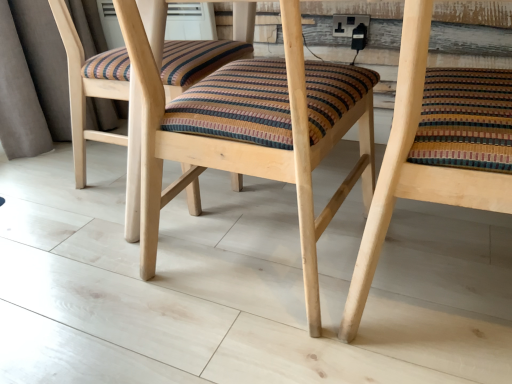
Question: Is wooden chair at center, the 1th chair viewed from the left, oriented away from wooden chair at center, the first chair in the right-to-left sequence?

Choices:
 (A) no
 (B) yes

Answer: (A)

Question: Is wooden chair at center, the second chair positioned from the right, closer to camera compared to wooden chair at center, the first chair in the right-to-left sequence?

Choices:
 (A) no
 (B) yes

Answer: (A)

Question: Is there a large distance between wooden chair at center, the second chair positioned from the right, and wooden chair at center, the first chair in the right-to-left sequence?

Choices:
 (A) yes
 (B) no

Answer: (B)

Question: Is wooden chair at center, the second chair positioned from the right, bigger than wooden chair at center, which appears as the 2th chair when viewed from the left?

Choices:
 (A) no
 (B) yes

Answer: (B)

Question: Is the depth of wooden chair at center, the second chair positioned from the right, greater than that of wooden chair at center, the first chair in the right-to-left sequence?

Choices:
 (A) yes
 (B) no

Answer: (A)

Question: Considering the relative sizes of wooden chair at center, the second chair positioned from the right, and wooden chair at center, the first chair in the right-to-left sequence, in the image provided, is wooden chair at center, the second chair positioned from the right, taller than wooden chair at center, the first chair in the right-to-left sequence,?

Choices:
 (A) yes
 (B) no

Answer: (A)

Question: Does wooden chair at center, which appears as the 2th chair when viewed from the left, have a larger size compared to wooden chair at center, the second chair positioned from the right?

Choices:
 (A) no
 (B) yes

Answer: (A)

Question: Does wooden chair at center, the first chair in the right-to-left sequence, come behind wooden chair at center, the second chair positioned from the right?

Choices:
 (A) no
 (B) yes

Answer: (A)

Question: Are wooden chair at center, which appears as the 2th chair when viewed from the left, and wooden chair at center, the 1th chair viewed from the left, located far from each other?

Choices:
 (A) no
 (B) yes

Answer: (A)

Question: From the image's perspective, is wooden chair at center, which appears as the 2th chair when viewed from the left, on top of wooden chair at center, the second chair positioned from the right?

Choices:
 (A) no
 (B) yes

Answer: (A)

Question: Is wooden chair at center, the 1th chair viewed from the left, at the back of wooden chair at center, which appears as the 2th chair when viewed from the left?

Choices:
 (A) no
 (B) yes

Answer: (A)

Question: Does wooden chair at center, the first chair in the right-to-left sequence, have a smaller size compared to wooden chair at center, the 1th chair viewed from the left?

Choices:
 (A) yes
 (B) no

Answer: (A)

Question: From the image's perspective, is wooden chair at center, which appears as the 2th chair when viewed from the left, above or below wooden chair at center, the 1th chair viewed from the left?

Choices:
 (A) below
 (B) above

Answer: (A)